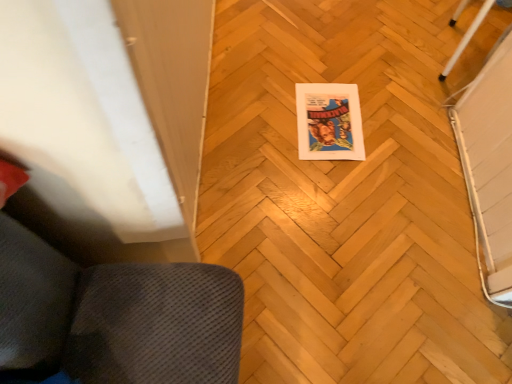
Locate an element on the screen. The image size is (512, 384). free point above matte paper comic book at center (from a real-world perspective) is located at coordinates (333, 120).